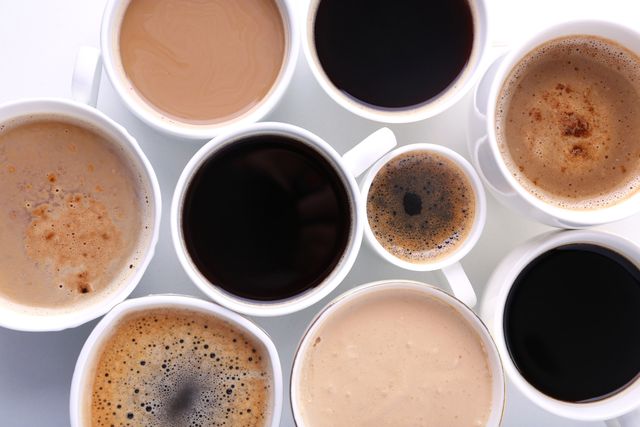
This screenshot has height=427, width=640. I want to click on mug handle, so click(628, 423), click(458, 285), click(378, 143), click(83, 77).